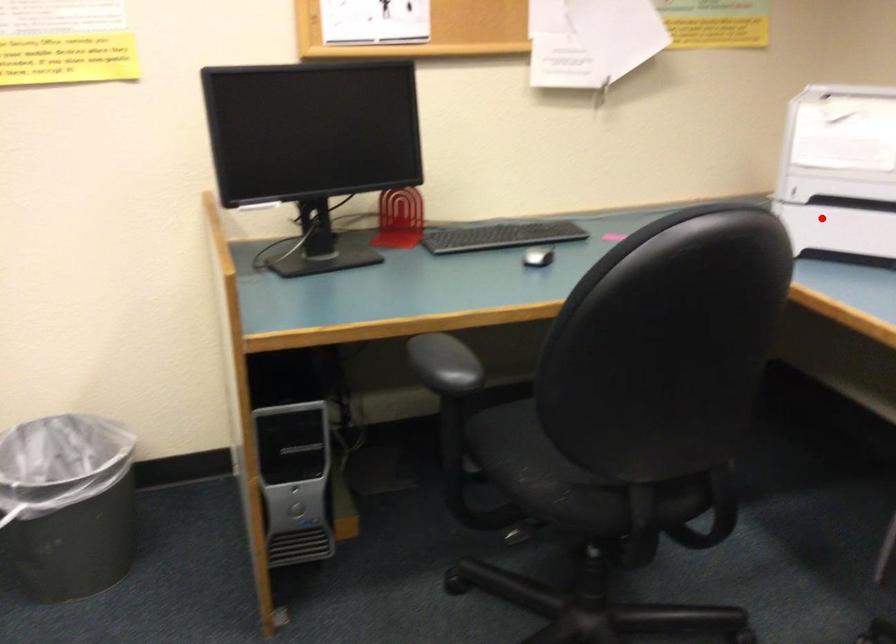
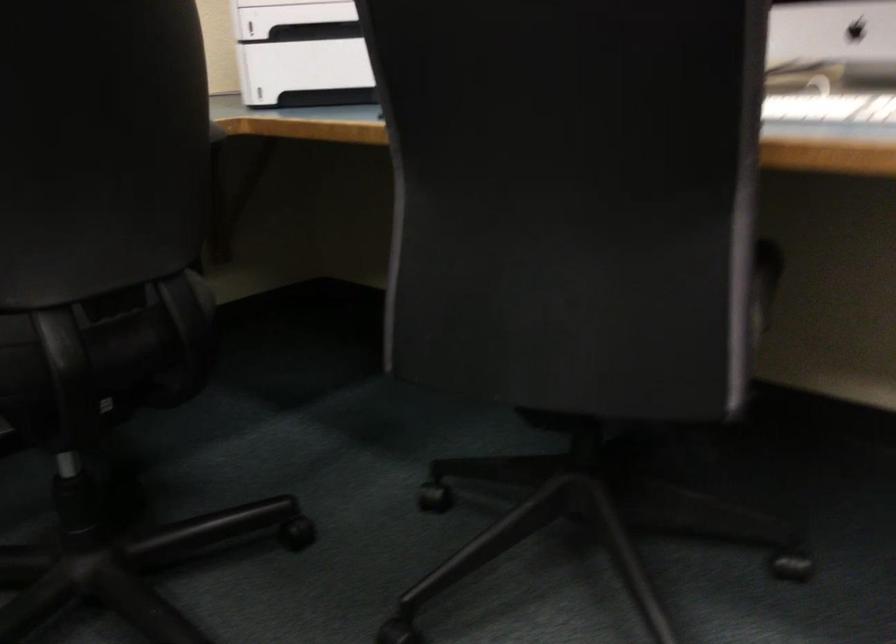
Question: I am providing you with two images of the same scene from different viewpoints. A red point is marked on the first image. Can you still see the location of the red point in image 2?

Choices:
 (A) Yes
 (B) No

Answer: (A)